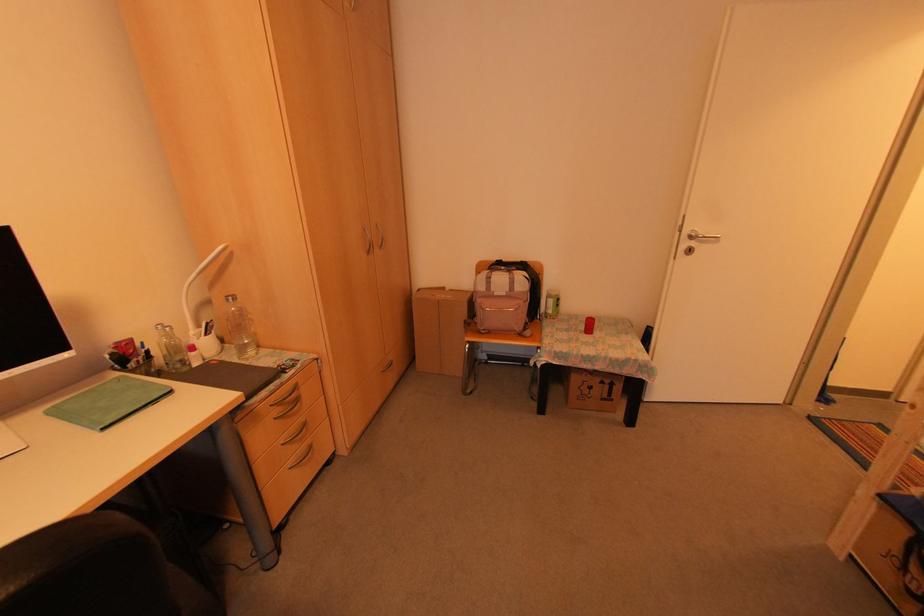
This screenshot has height=616, width=924. Identify the location of silver door handle. (392, 366).